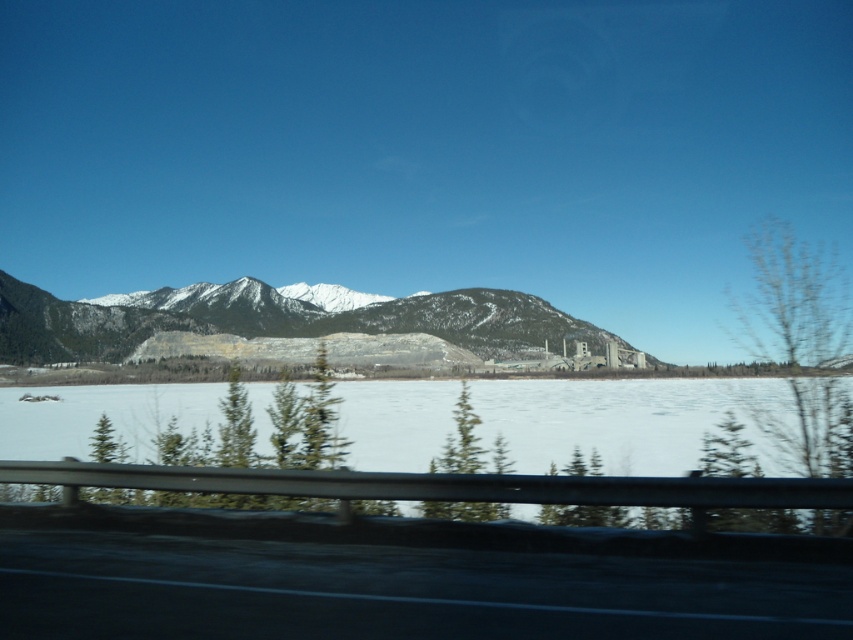
You are standing at the metal guardrail in the foreground of the winter landscape. You see two points marked on the frozen lake ahead of you. Which point is closer to you, point (569, 602) or point (486, 288)?

Point (569, 602) is closer to you than point (486, 288).

You are driving along the black asphalt highway at lower center and want to reach the white ice at center. According to the scene, which direction should you head to get there?

The black asphalt highway at lower center is in front of white ice at center, so you should drive forward along the black asphalt highway at lower center to reach the white ice at center.